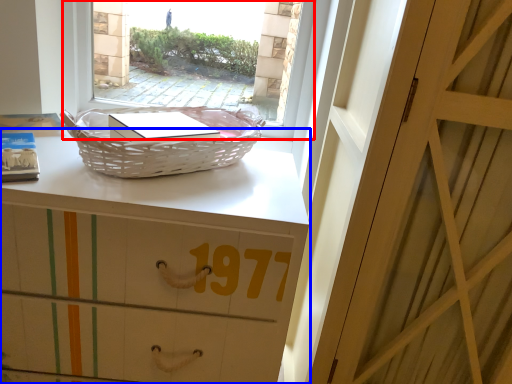
Question: Which point is further to the camera, window (highlighted by a red box) or desk (highlighted by a blue box)?

Choices:
 (A) window
 (B) desk

Answer: (A)